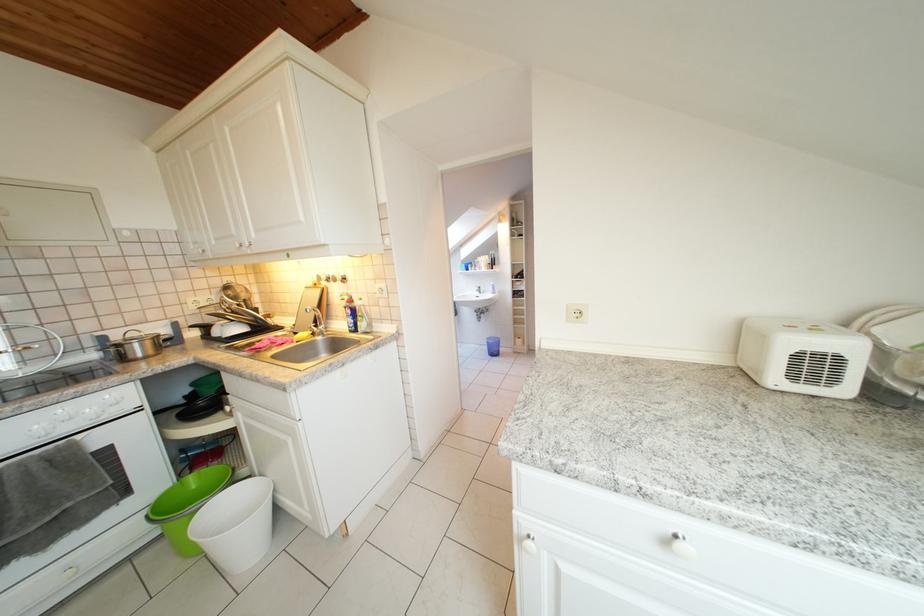
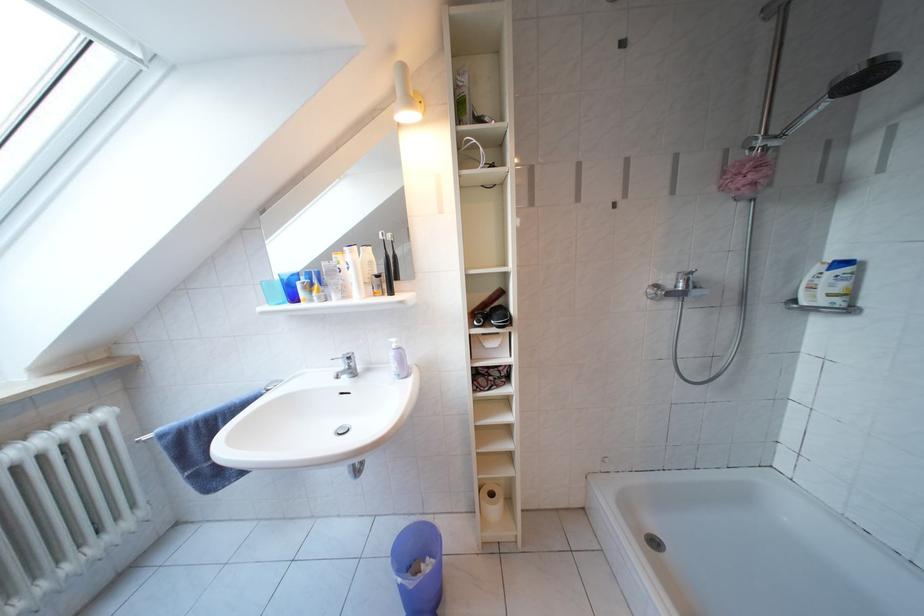
Where in the second image is the point corresponding to the point at 500,294 from the first image?

(402, 371)